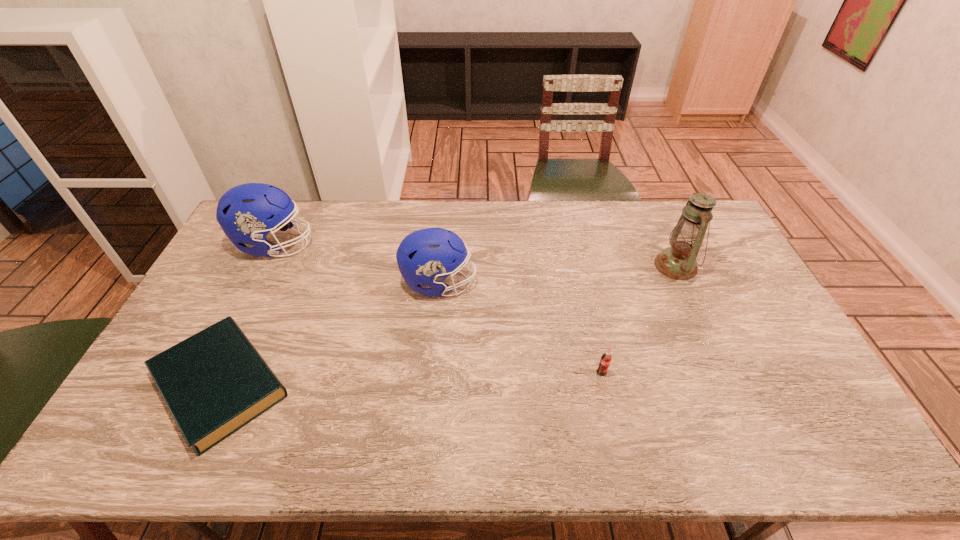
You are a GUI agent. You are given a task and a screenshot of the screen. Output one action in this format:
    pyautogui.click(x=<x>, y=<y>)
    Task: Click on the vacant region located 0.210m on the front-facing side of the third object from right to left
    This screenshot has height=540, width=960.
    Given the screenshot: What is the action you would take?
    pyautogui.click(x=541, y=284)

Locate an element on the screen. Image resolution: width=960 pixels, height=540 pixels. free space located 0.190m on the label of the second object from right to left is located at coordinates (618, 446).

The height and width of the screenshot is (540, 960). Identify the location of vacant space located on the right of the shortest object. (339, 384).

At what (x,y) coordinates should I click in order to perform the action: click on object that is at the far edge. Please return your answer as a coordinate pair (x, y). This screenshot has width=960, height=540. Looking at the image, I should click on (246, 213).

Where is `object that is at the near edge`? Image resolution: width=960 pixels, height=540 pixels. object that is at the near edge is located at coordinates (215, 382).

Image resolution: width=960 pixels, height=540 pixels. Find the location of `football helmet that is positioned at the left edge`. football helmet that is positioned at the left edge is located at coordinates (246, 213).

The image size is (960, 540). In order to click on book located in the left edge section of the desktop in this screenshot , I will do `click(215, 382)`.

Find the location of a particular element. object that is at the right edge is located at coordinates click(x=678, y=262).

The width and height of the screenshot is (960, 540). Identify the location of object situated at the far left corner. (246, 213).

Identify the location of object located in the near left corner section of the desktop. The image size is (960, 540). (215, 382).